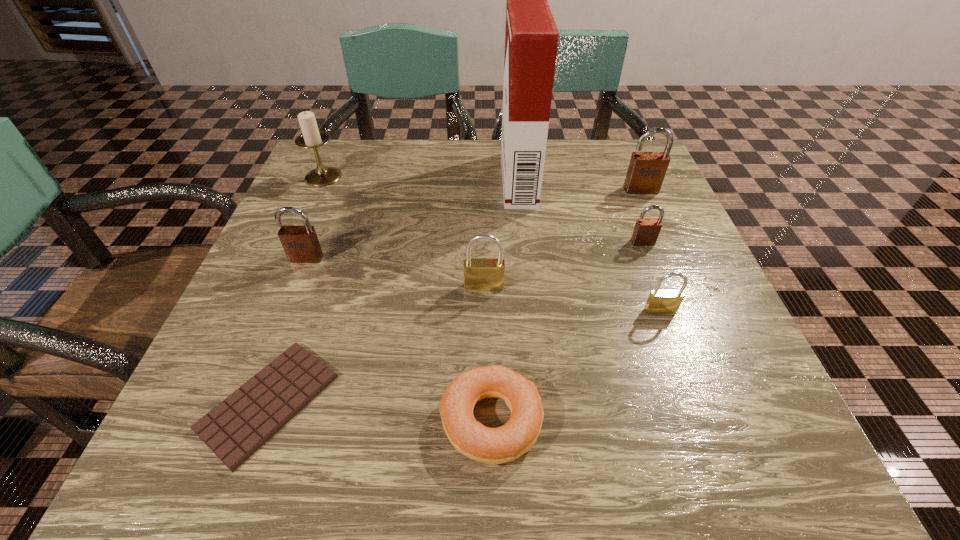
You are a GUI agent. You are given a task and a screenshot of the screen. Output one action in this format:
    pyautogui.click(x=<x>, y=<y>)
    Task: Click on the padlock that is at the far edge
    The height and width of the screenshot is (540, 960).
    Given the screenshot: What is the action you would take?
    pyautogui.click(x=646, y=172)

Locate an element on the screen. bagel that is at the near edge is located at coordinates (494, 446).

Where is `chocolate bar present at the near edge`? This screenshot has height=540, width=960. chocolate bar present at the near edge is located at coordinates (237, 427).

Locate an element on the screen. This screenshot has height=540, width=960. candle holder present at the left edge is located at coordinates (311, 137).

The image size is (960, 540). I want to click on padlock located at the left edge, so click(x=301, y=245).

Where is `chocolate bar at the left edge`? This screenshot has width=960, height=540. chocolate bar at the left edge is located at coordinates (237, 427).

You are a GUI agent. You are given a task and a screenshot of the screen. Output one action in this format:
    pyautogui.click(x=<x>, y=<y>)
    Task: Click on the object situated at the far left corner
    
    Given the screenshot: What is the action you would take?
    pyautogui.click(x=311, y=137)

At what (x,y) coordinates should I click in order to perform the action: click on object positioned at the near left corner. Please return your answer as a coordinate pair (x, y). Looking at the image, I should click on (237, 427).

Locate an element on the screen. object that is at the far right corner is located at coordinates (646, 172).

What are the coordinates of `free space at the far edge of the desktop` in the screenshot? It's located at (472, 147).